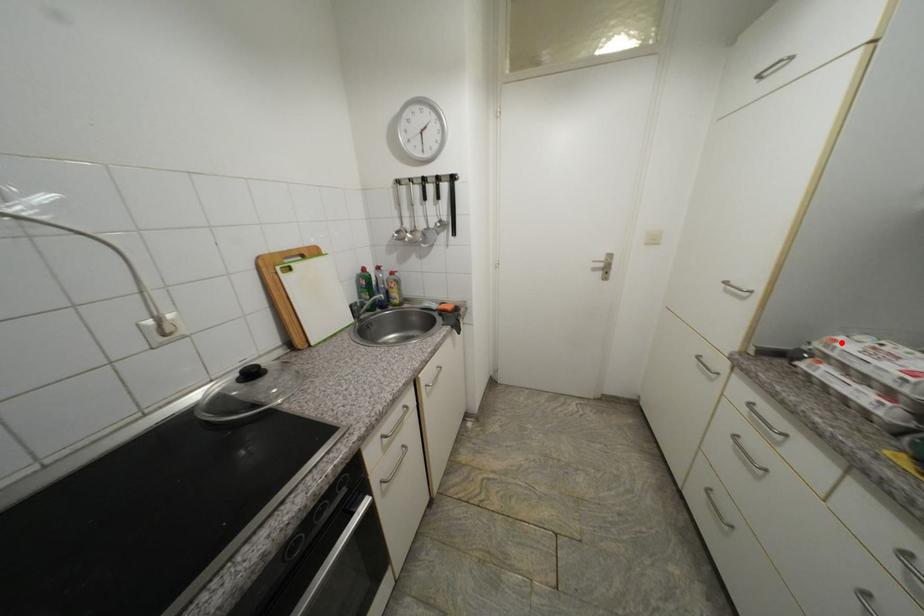
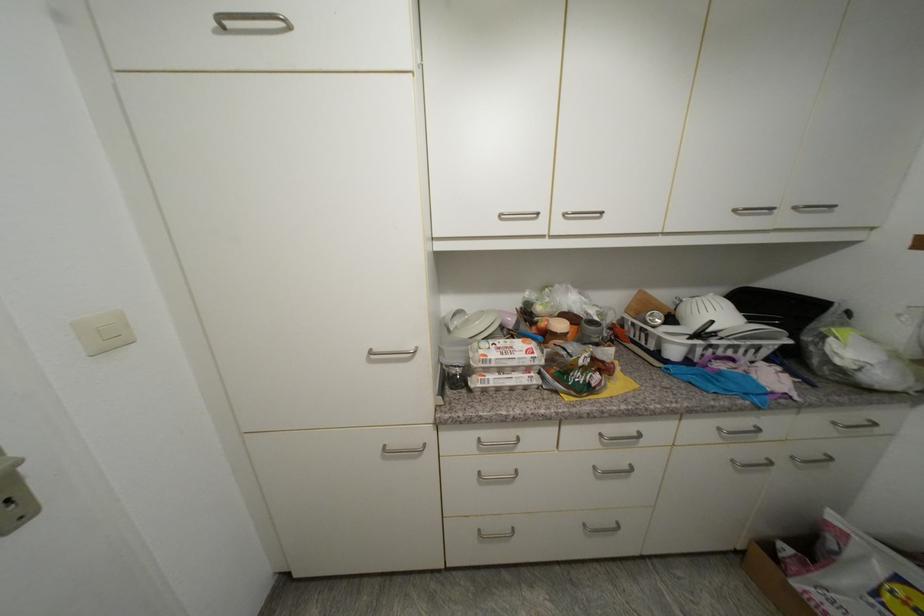
The point at the highlighted location is marked in the first image. Where is the corresponding point in the second image?

(492, 357)